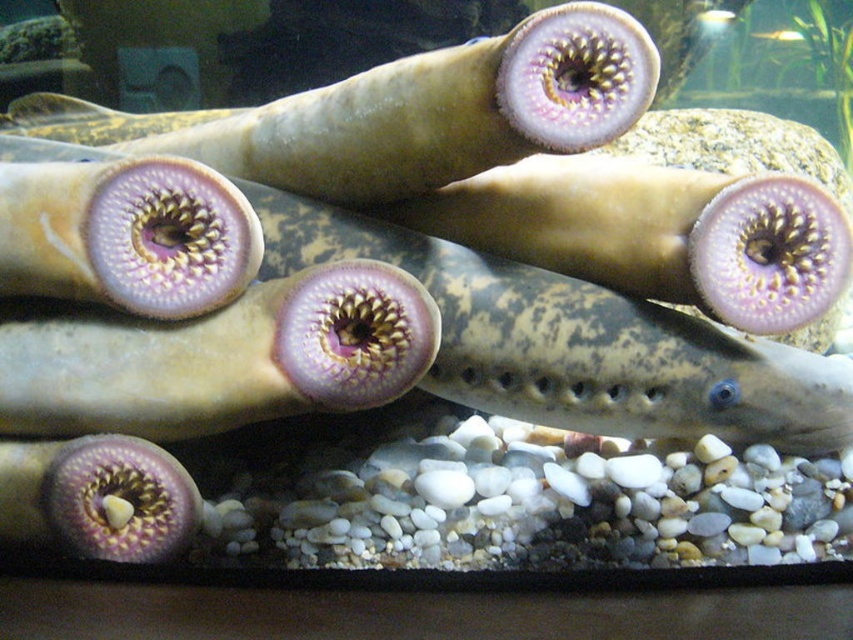
Question: Can you confirm if speckled skin eel at center is positioned to the right of pink matte/skinny fish at center?

Choices:
 (A) yes
 (B) no

Answer: (A)

Question: Observing the image, what is the correct spatial positioning of smooth beige fish at center in reference to pink matte/soft eel at center?

Choices:
 (A) right
 (B) left

Answer: (A)

Question: Based on their relative distances, which object is farther from the speckled skin eel at center?

Choices:
 (A) pinkish-purple smooth eel at upper center
 (B) pink matte/skinny fish at center
 (C) pink matte/soft eel at center
 (D) smooth beige fish at center

Answer: (C)

Question: Is speckled skin eel at center below pink matte/skinny fish at center?

Choices:
 (A) yes
 (B) no

Answer: (B)

Question: Which of these objects is positioned farthest from the pink matte/soft eel at center?

Choices:
 (A) smooth beige fish at center
 (B) speckled skin eel at center
 (C) pinkish-purple smooth eel at upper center

Answer: (A)

Question: Which of the following is the closest to the observer?

Choices:
 (A) (260, 289)
 (B) (799, 221)
 (C) (447, 106)
 (D) (433, 237)

Answer: (A)